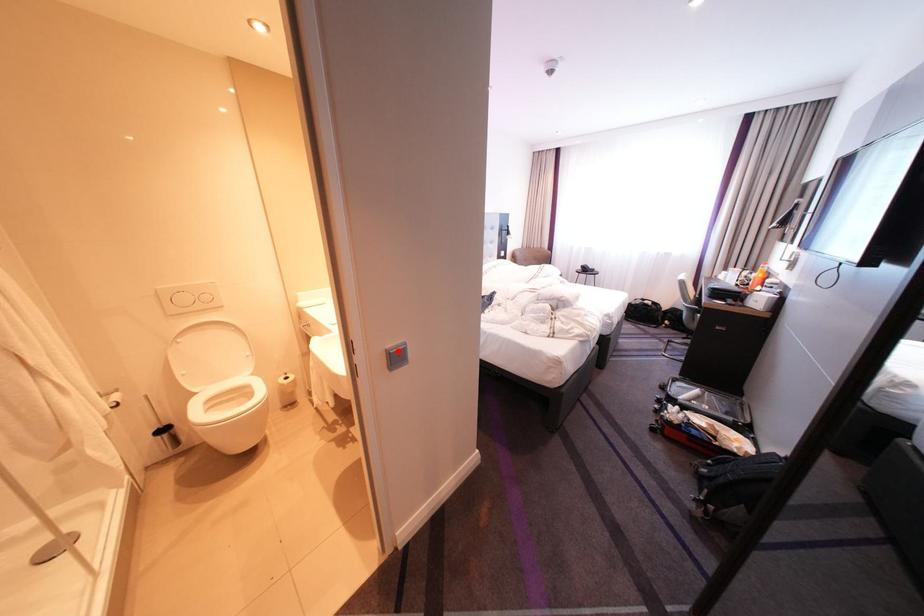
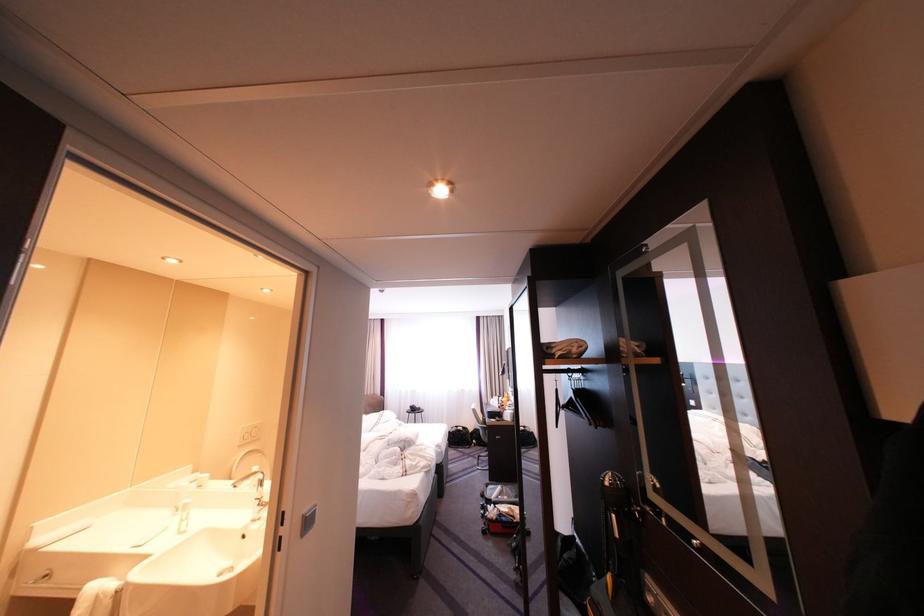
Find the pixel in the second image that matches the highlighted location in the first image.

(314, 516)